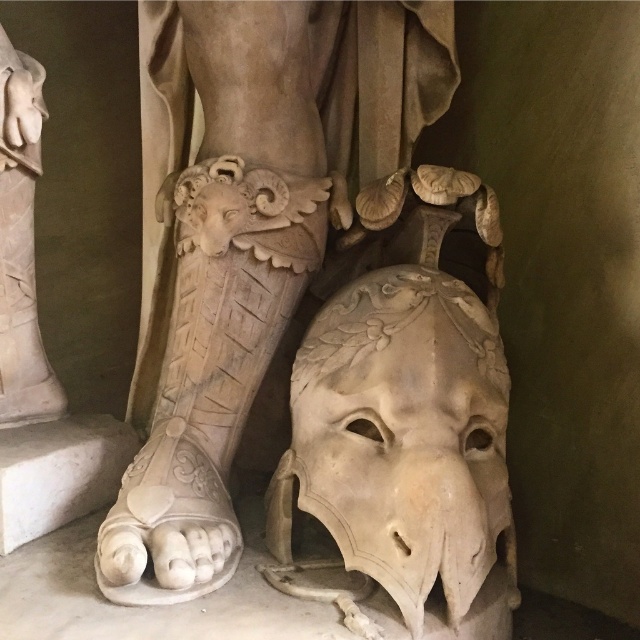
Looking at this image, which is more to the left, white marble mask at lower center or matte stone mask at lower center?

Positioned to the left is white marble mask at lower center.

Is point (333, 12) farther from viewer compared to point (355, 333)?

Yes, point (333, 12) is farther from viewer.

You are a GUI agent. You are given a task and a screenshot of the screen. Output one action in this format:
    pyautogui.click(x=<x>, y=<y>)
    Task: Click on the white marble mask at lower center
    The height and width of the screenshot is (640, 640).
    Given the screenshot: What is the action you would take?
    pyautogui.click(x=248, y=237)